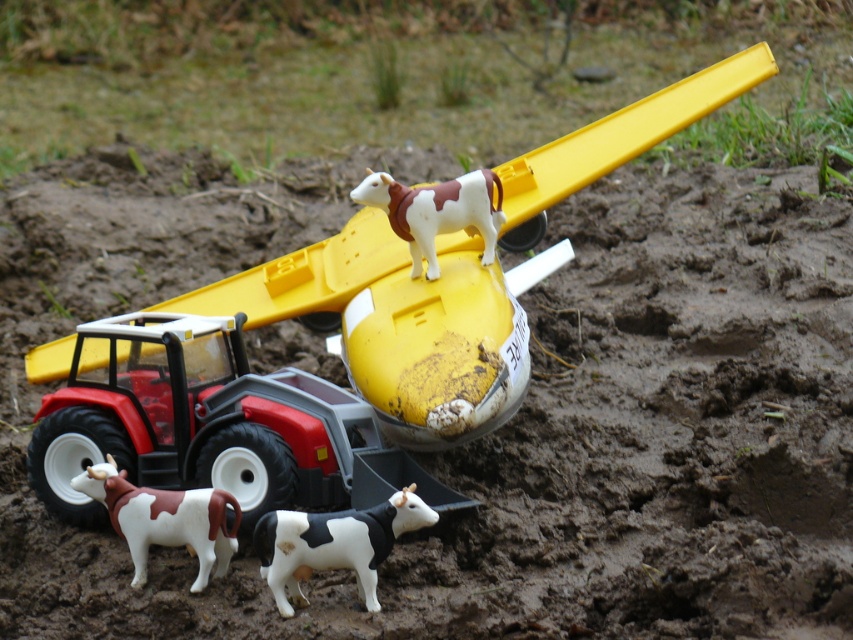
You are standing at the point marked by coordinates (x=289, y=374) in the image. What object are you directly on top of?

The point marked by coordinates (x=289, y=374) is directly on top of the yellow plastic airplane at center.

You are standing 10 feet away from the point at coordinates point (181,365). Can you reach the point without moving closer?

The distance of point (181,365) from viewer is 8.78 feet, so you are currently 10 feet away. Since 10 feet is farther than 8.78 feet, you need to move closer to reach the point.

From the picture: You are a child who wants to place a new toy between the black and white plastic cow at lower center and the brown and white plastic cow at lower left. The toy is 6 inches long. Can you fit it between them without overlapping?

The distance between the black and white plastic cow at lower center and the brown and white plastic cow at lower left is 7.09 inches. Since the toy is 6 inches long, it can fit between them without overlapping.